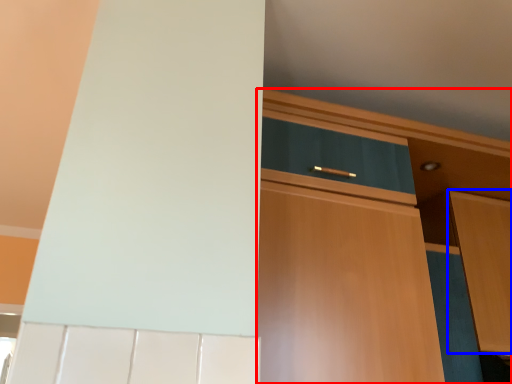
Question: Which object is further to the camera taking this photo, cabinetry (highlighted by a red box) or cabinetry (highlighted by a blue box)?

Choices:
 (A) cabinetry
 (B) cabinetry

Answer: (B)